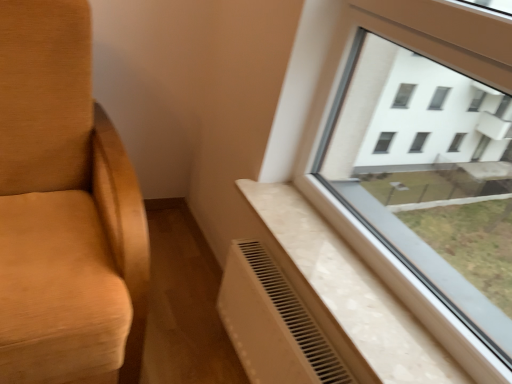
Question: Considering the positions of white textured radiator at lower right and white plastic radiator at lower center in the image, is white textured radiator at lower right wider or thinner than white plastic radiator at lower center?

Choices:
 (A) thin
 (B) wide

Answer: (B)

Question: Is point (368, 269) closer or farther from the camera than point (294, 349)?

Choices:
 (A) farther
 (B) closer

Answer: (A)

Question: In terms of height, does white textured radiator at lower right look taller or shorter compared to white plastic radiator at lower center?

Choices:
 (A) short
 (B) tall

Answer: (A)

Question: In terms of width, does white plastic radiator at lower center look wider or thinner when compared to white textured radiator at lower right?

Choices:
 (A) thin
 (B) wide

Answer: (A)

Question: Is white plastic radiator at lower center taller or shorter than white textured radiator at lower right?

Choices:
 (A) tall
 (B) short

Answer: (A)

Question: Relative to white textured radiator at lower right, is white plastic radiator at lower center in front or behind?

Choices:
 (A) front
 (B) behind

Answer: (B)

Question: Do you think white plastic radiator at lower center is within white textured radiator at lower right, or outside of it?

Choices:
 (A) inside
 (B) outside

Answer: (B)